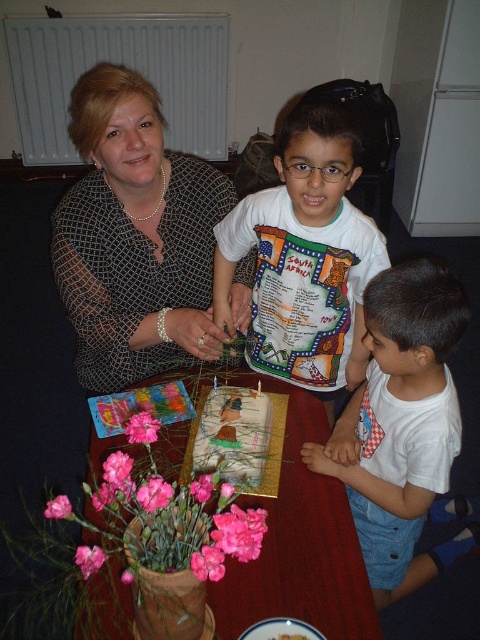
You are a photographer standing at the back of the room. You want to take a photo of the decorative paper cake at center without the white cotton shirt at lower right blocking it. Is the shirt too big to avoid blocking the cake in the frame?

The white cotton shirt at lower right has a larger size compared to decorative paper cake at center, so it might block the cake if positioned too close. Adjust your angle or move closer to ensure the shirt doesn not obstruct the cake.

You are planning to place a new vase on the smooth wooden table at center. Considering the current objects on the table, will the matte black dress at center occupy too much space for the vase to fit comfortably?

The matte black dress at center has a lesser width compared to the smooth wooden table at center, so there should be enough space left on the smooth wooden table at center to comfortably place the new vase.

You are planning to place a large centerpiece on the smooth wooden table at center where the decorative paper cake at center is currently located. Based on the scene description, will the new centerpiece fit on the table without hanging over the edges?

The smooth wooden table at center is bigger than decorative paper cake at center, so the new centerpiece should fit without hanging over the edges since the table has enough space.